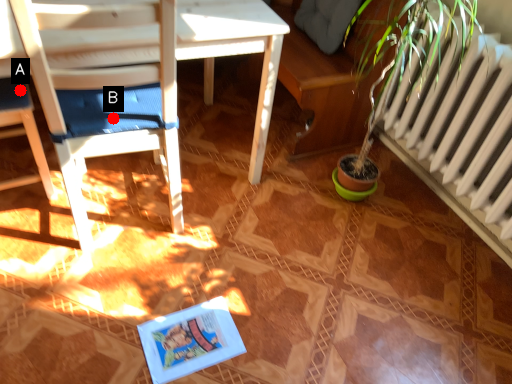
Question: Two points are circled on the image, labeled by A and B beside each circle. Which point is closer to the camera?

Choices:
 (A) A is closer
 (B) B is closer

Answer: (B)